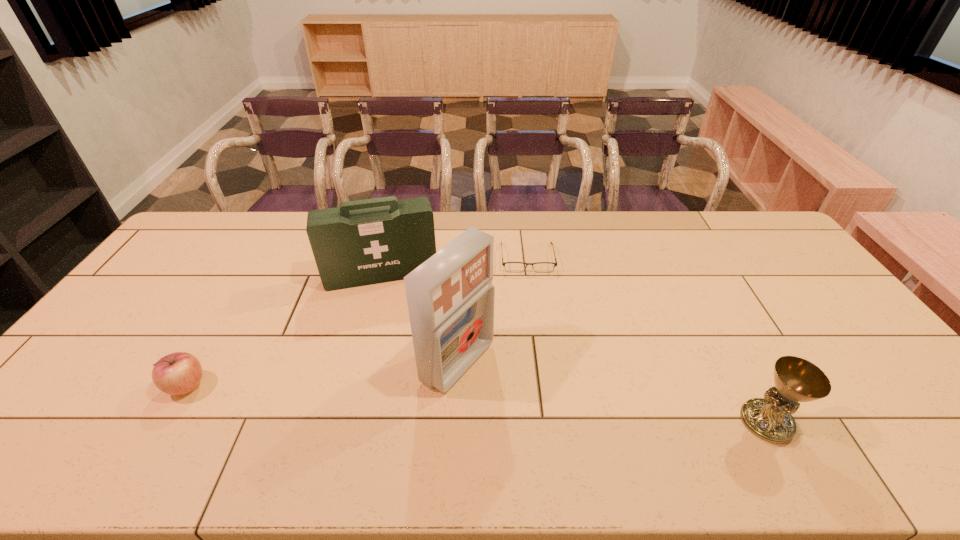
Where is `vacant region located 0.080m on the back of the fourth tallest object`? The width and height of the screenshot is (960, 540). vacant region located 0.080m on the back of the fourth tallest object is located at coordinates [x=210, y=346].

The width and height of the screenshot is (960, 540). Find the location of `free spot located 0.300m on the left of the rightmost object`. free spot located 0.300m on the left of the rightmost object is located at coordinates (615, 422).

Identify the location of blank area located 0.080m on the front-facing side of the farther first-aid kit. Image resolution: width=960 pixels, height=540 pixels. (394, 309).

The width and height of the screenshot is (960, 540). I want to click on blank space located 0.080m on the front-facing side of the farther first-aid kit, so click(394, 309).

I want to click on vacant space located on the front-facing side of the farther first-aid kit, so click(x=397, y=341).

I want to click on vacant space located on the front-facing side of the spectacles, so click(538, 349).

The width and height of the screenshot is (960, 540). Find the location of `free space located on the front-facing side of the spectacles`. free space located on the front-facing side of the spectacles is located at coordinates (538, 352).

The width and height of the screenshot is (960, 540). I want to click on free space located on the front-facing side of the spectacles, so click(533, 310).

You are a GUI agent. You are given a task and a screenshot of the screen. Output one action in this format:
    pyautogui.click(x=<x>, y=<y>)
    Task: Click on the object at the far edge
    Image resolution: width=960 pixels, height=540 pixels.
    Given the screenshot: What is the action you would take?
    pyautogui.click(x=542, y=267)

At what (x,y) coordinates should I click in order to perform the action: click on apple that is at the near edge. Please return your answer as a coordinate pair (x, y). This screenshot has height=540, width=960. Looking at the image, I should click on click(178, 373).